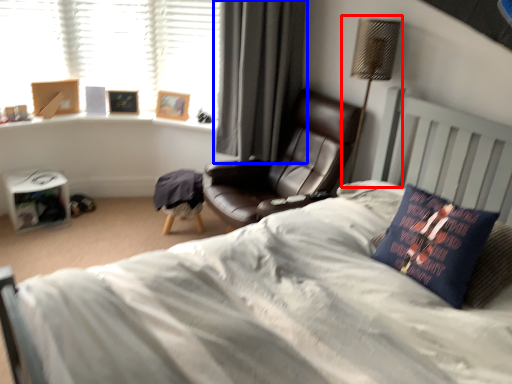
Question: Among these objects, which one is farthest to the camera, table lamp (highlighted by a red box) or curtain (highlighted by a blue box)?

Choices:
 (A) table lamp
 (B) curtain

Answer: (B)